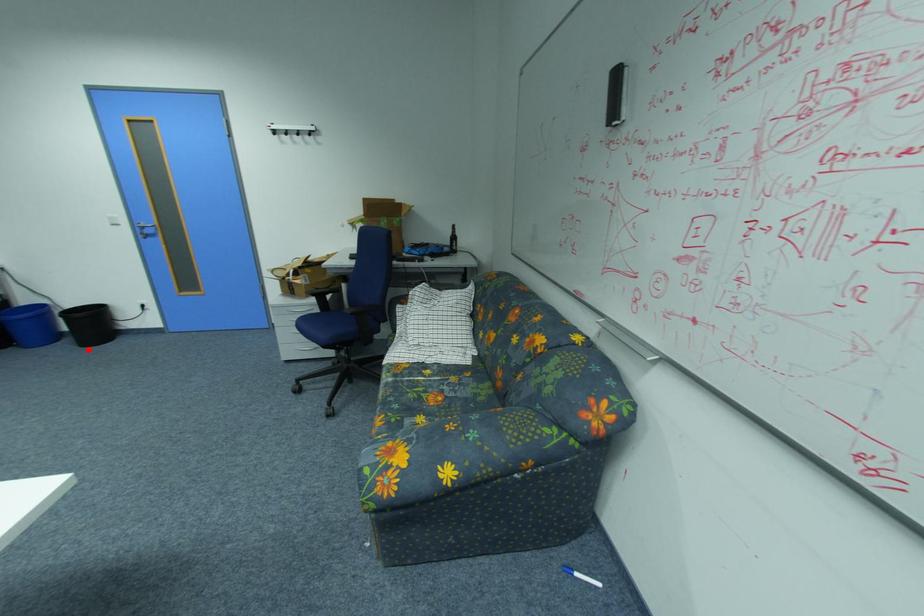
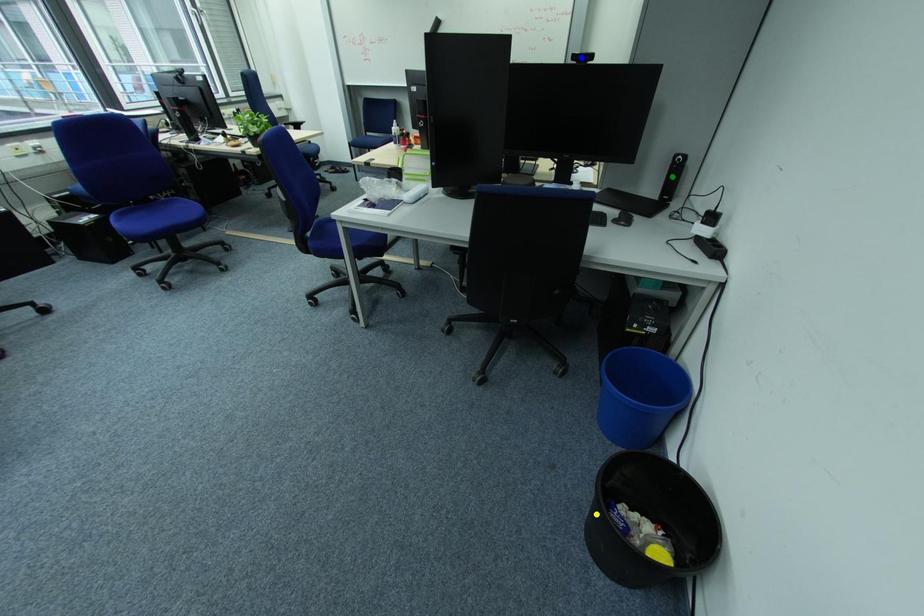
Question: I am providing you with two images of the same scene from different viewpoints. A red point is marked on the first image. You are given multiple points on the second image. Which point in image 2 is actually the same real-world point as the red point in image 1?

Choices:
 (A) yellow point
 (B) blue point
 (C) green point

Answer: (A)